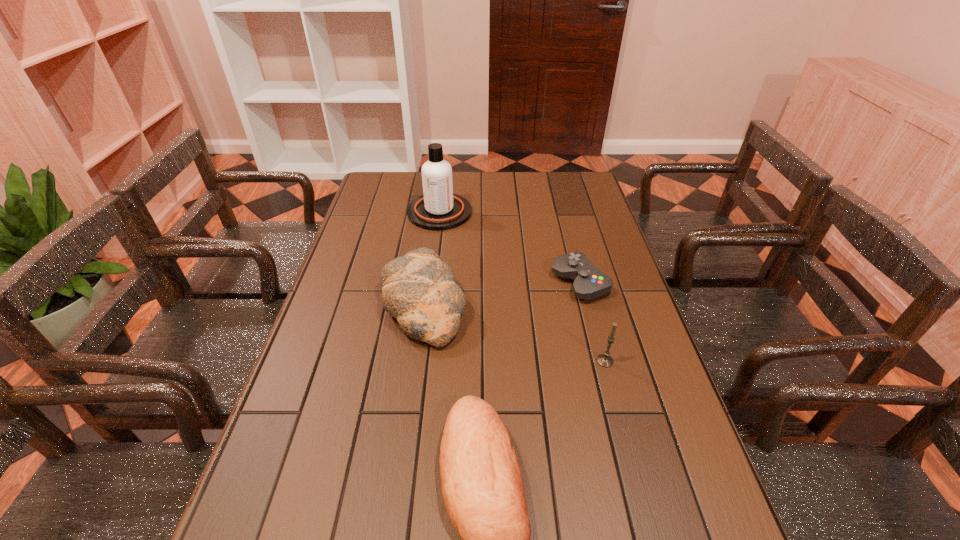
I want to click on empty location between the taller bread and the shortest object, so tap(501, 293).

Locate an element on the screen. This screenshot has height=540, width=960. object identified as the closest to the farthest object is located at coordinates (418, 289).

The width and height of the screenshot is (960, 540). Find the location of `object identified as the fourth closest to the candle`. object identified as the fourth closest to the candle is located at coordinates (438, 209).

Identify the location of vacant space that satisfies the following two spatial constraints: 1. on the back side of the farther bread; 2. on the left side of the tallest object. (436, 212).